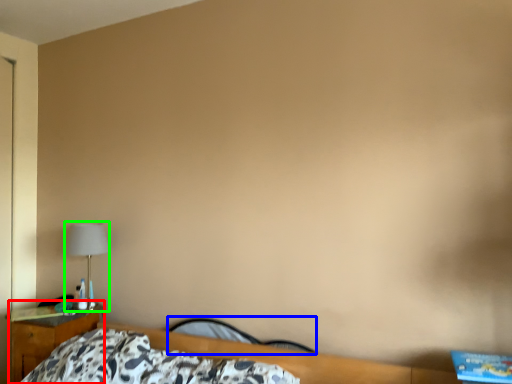
Question: Based on their relative distances, which object is nearer to nightstand (highlighted by a red box)? Choose from chair (highlighted by a blue box) and lamp (highlighted by a green box).

Choices:
 (A) chair
 (B) lamp

Answer: (B)